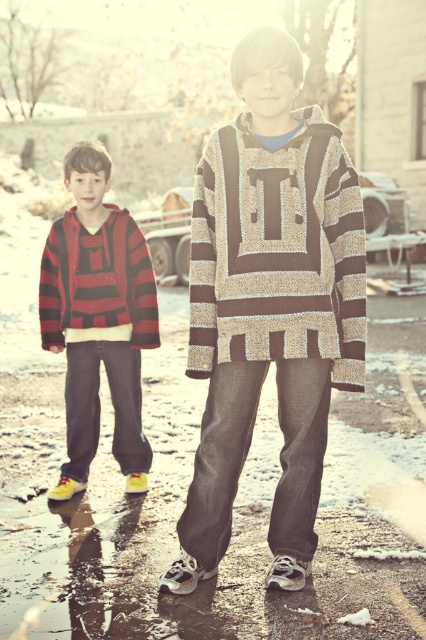
Question: Which point appears closest to the camera in this image?

Choices:
 (A) (230, 282)
 (B) (74, 224)
 (C) (273, 312)

Answer: (C)

Question: Does knitted wool poncho at center appear under red and black striped sweater at left?

Choices:
 (A) yes
 (B) no

Answer: (A)

Question: Considering the relative positions of knitted wool poncho at center and knitted wool sweater at left in the image provided, where is knitted wool poncho at center located with respect to knitted wool sweater at left?

Choices:
 (A) left
 (B) right

Answer: (B)

Question: Which object appears closest to the camera in this image?

Choices:
 (A) knitted wool poncho at center
 (B) knitted beige sweater at center

Answer: (A)

Question: Which of these objects is positioned farthest from the knitted wool sweater at left?

Choices:
 (A) knitted beige sweater at center
 (B) red and black striped sweater at left

Answer: (A)

Question: Can you confirm if knitted wool sweater at left is positioned to the right of red and black striped sweater at left?

Choices:
 (A) yes
 (B) no

Answer: (A)